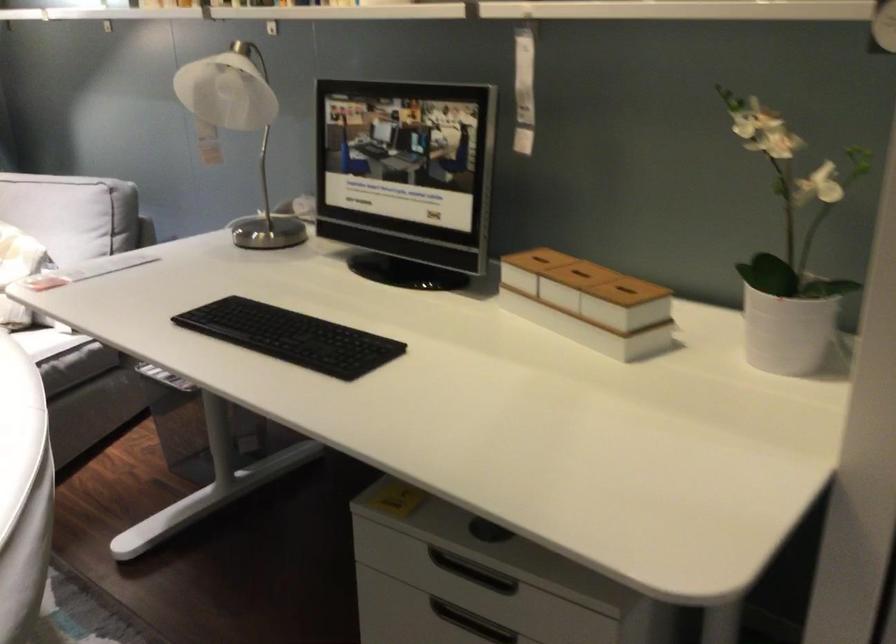
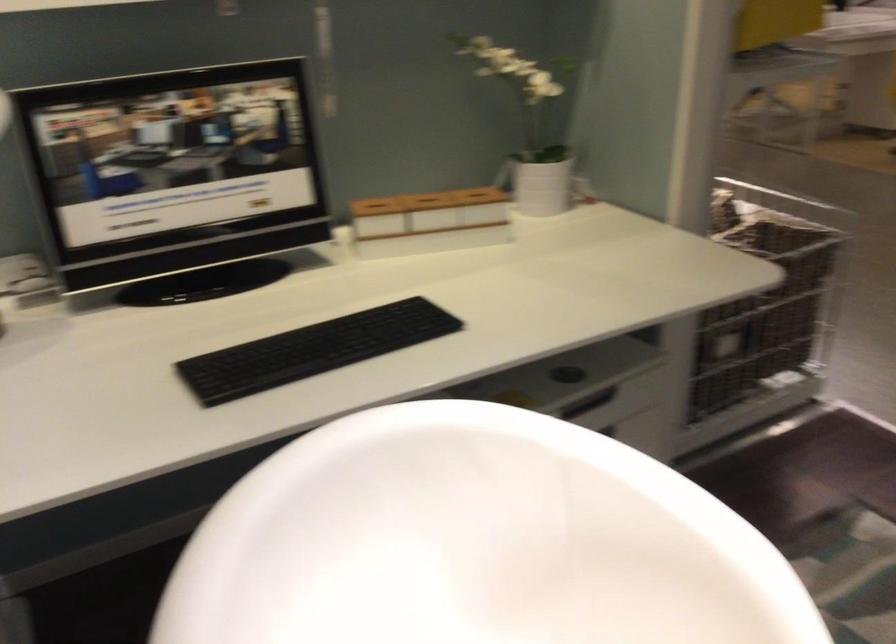
Where in the second image is the point corresponding to pixel 734 310 from the first image?

(543, 182)